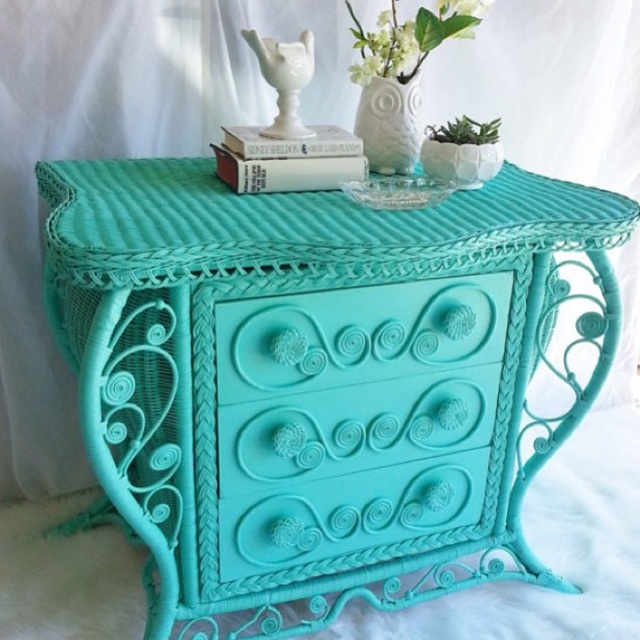
Between point (394, 45) and point (397, 81), which one is positioned in front?

Point (394, 45)

This screenshot has height=640, width=640. Describe the element at coordinates (410, 36) in the screenshot. I see `white matte vase at upper center` at that location.

Is point (422, 22) in front of point (403, 156)?

Yes, it is in front of point (403, 156).

In order to click on white matte vase at upper center in this screenshot , I will do `click(410, 36)`.

Is turquoise wicker table at center thinner than hardcover book at center?

Incorrect, turquoise wicker table at center's width is not less than hardcover book at center's.

Does point (442, 420) come farther from viewer compared to point (292, 172)?

Yes, it is.

Between point (349, 497) and point (285, 173), which one is positioned behind?

Point (349, 497)

At what (x,y) coordinates should I click in order to perform the action: click on turquoise wicker table at center. Please return your answer as a coordinate pair (x, y). The image size is (640, 640). Looking at the image, I should click on (317, 380).

Can you confirm if turquoise wicker table at center is thinner than turquoise matte drawer at center?

No.

Between turquoise wicker table at center and turquoise matte drawer at center, which one has less height?

Standing shorter between the two is turquoise matte drawer at center.

Between point (128, 291) and point (308, 348), which one is positioned behind?

The point (308, 348) is more distant.

Image resolution: width=640 pixels, height=640 pixels. What are the coordinates of `turquoise wicker table at center` in the screenshot? It's located at (317, 380).